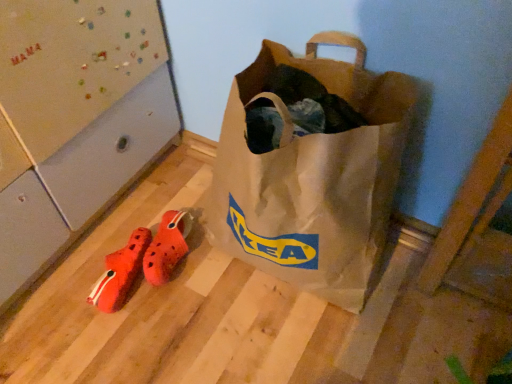
Question: Is matte brown paper bag at center surrounded by orange rubber clogs at lower left?

Choices:
 (A) yes
 (B) no

Answer: (B)

Question: From a real-world perspective, is orange rubber clogs at lower left physically below matte brown paper bag at center?

Choices:
 (A) yes
 (B) no

Answer: (A)

Question: Is orange rubber clogs at lower left thinner than matte brown paper bag at center?

Choices:
 (A) yes
 (B) no

Answer: (A)

Question: From the image's perspective, is orange rubber clogs at lower left on top of matte brown paper bag at center?

Choices:
 (A) yes
 (B) no

Answer: (B)

Question: From the image's perspective, is orange rubber clogs at lower left under matte brown paper bag at center?

Choices:
 (A) yes
 (B) no

Answer: (A)

Question: Is point (102, 306) positioned closer to the camera than point (152, 266)?

Choices:
 (A) farther
 (B) closer

Answer: (A)

Question: Looking at their shapes, would you say orange fabric shoe at lower left is wider or thinner than orange rubber clogs at lower left?

Choices:
 (A) wide
 (B) thin

Answer: (B)

Question: From a real-world perspective, is orange fabric shoe at lower left positioned above or below orange rubber clogs at lower left?

Choices:
 (A) below
 (B) above

Answer: (A)

Question: From the image's perspective, relative to orange rubber clogs at lower left, is orange fabric shoe at lower left above or below?

Choices:
 (A) below
 (B) above

Answer: (A)

Question: Looking at the image, does orange fabric shoe at lower left seem bigger or smaller compared to matte brown paper bag at center?

Choices:
 (A) big
 (B) small

Answer: (B)

Question: Considering the relative positions of orange fabric shoe at lower left and matte brown paper bag at center in the image provided, is orange fabric shoe at lower left to the left or to the right of matte brown paper bag at center?

Choices:
 (A) left
 (B) right

Answer: (A)

Question: Considering the positions of orange fabric shoe at lower left and matte brown paper bag at center in the image, is orange fabric shoe at lower left taller or shorter than matte brown paper bag at center?

Choices:
 (A) short
 (B) tall

Answer: (A)

Question: Is orange fabric shoe at lower left in front of or behind matte brown paper bag at center in the image?

Choices:
 (A) behind
 (B) front

Answer: (A)

Question: Based on their sizes in the image, would you say orange rubber clogs at lower left is bigger or smaller than matte brown paper bag at center?

Choices:
 (A) small
 (B) big

Answer: (A)

Question: Would you say orange rubber clogs at lower left is to the left or to the right of matte brown paper bag at center in the picture?

Choices:
 (A) left
 (B) right

Answer: (A)